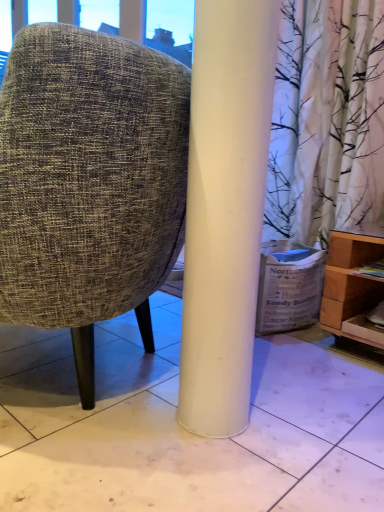
Question: Is white glossy tile at center wider or thinner than white cardboard box at lower right?

Choices:
 (A) thin
 (B) wide

Answer: (B)

Question: From the image's perspective, is white glossy tile at center located above or below white cardboard box at lower right?

Choices:
 (A) below
 (B) above

Answer: (A)

Question: Which of these objects is positioned closest to the light brown wooden shelf at lower right?

Choices:
 (A) white glossy tile at center
 (B) white cardboard box at lower right
 (C) textured fabric chair at center

Answer: (B)

Question: Estimate the real-world distances between objects in this image. Which object is farther from the white glossy tile at center?

Choices:
 (A) white cardboard box at lower right
 (B) light brown wooden shelf at lower right
 (C) textured fabric chair at center

Answer: (B)